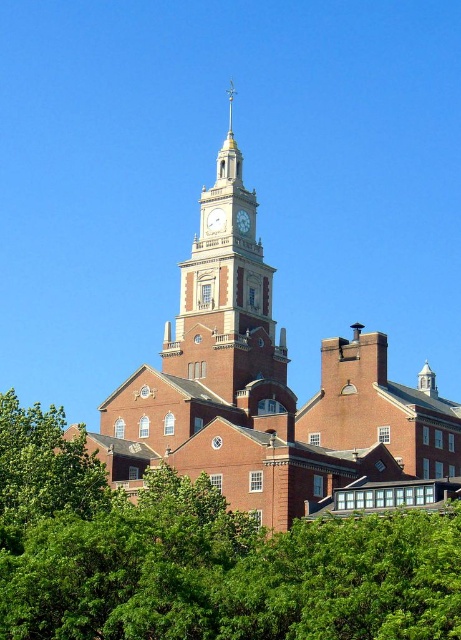
You are standing in front of the historic building and want to take a photo that includes both the green leafy tree at lower left and the matte gold clock at center. Since you want the tree to appear larger in the photo than the clock, where should you position yourself relative to them?

To make the green leafy tree at lower left appear larger than the matte gold clock at center in the photo, you should position yourself closer to the green leafy tree at lower left since it is taller than the matte gold clock at center.